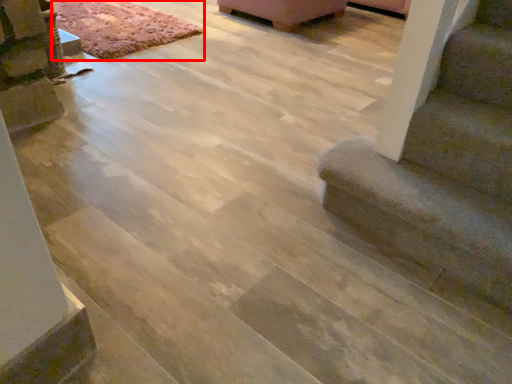
Question: Where is mat (annotated by the red box) located in relation to stairs in the image?

Choices:
 (A) right
 (B) left

Answer: (B)